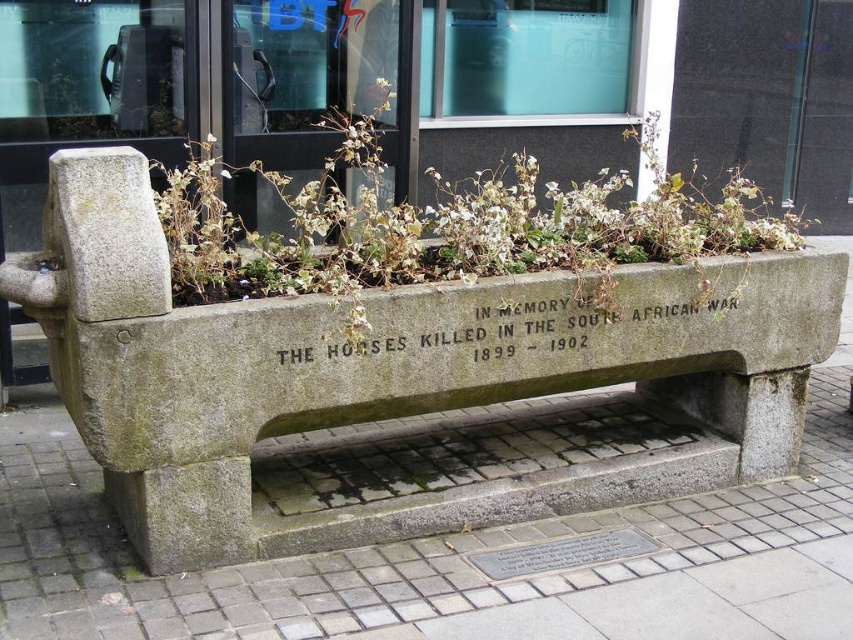
Can you confirm if green leafy plant at center is wider than black stone engraving at center?

Indeed, green leafy plant at center has a greater width compared to black stone engraving at center.

Locate an element on the screen. This screenshot has height=640, width=853. green leafy plant at center is located at coordinates (447, 227).

Which is in front, point (351, 294) or point (691, 324)?

Point (351, 294)

Locate an element on the screen. The image size is (853, 640). green leafy plant at center is located at coordinates (447, 227).

Does gray concrete bench at lower center have a lesser height compared to green leafy plant at center?

Yes.

Measure the distance between gray concrete bench at lower center and green leafy plant at center.

gray concrete bench at lower center is 38.64 inches away from green leafy plant at center.

Image resolution: width=853 pixels, height=640 pixels. What are the coordinates of `gray concrete bench at lower center` in the screenshot? It's located at (393, 557).

Is gray concrete bench at lower center above black stone engraving at center?

Actually, gray concrete bench at lower center is below black stone engraving at center.

Is point (664, 582) more distant than point (405, 310)?

Yes, point (664, 582) is behind point (405, 310).

What are the coordinates of `gray concrete bench at lower center` in the screenshot? It's located at (393, 557).